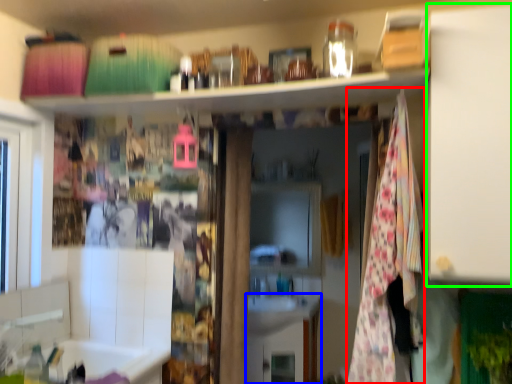
Question: Based on their relative distances, which object is nearer to blanket (highlighted by a red box)? Choose from cabinetry (highlighted by a blue box) and cabinet (highlighted by a green box).

Choices:
 (A) cabinetry
 (B) cabinet

Answer: (B)